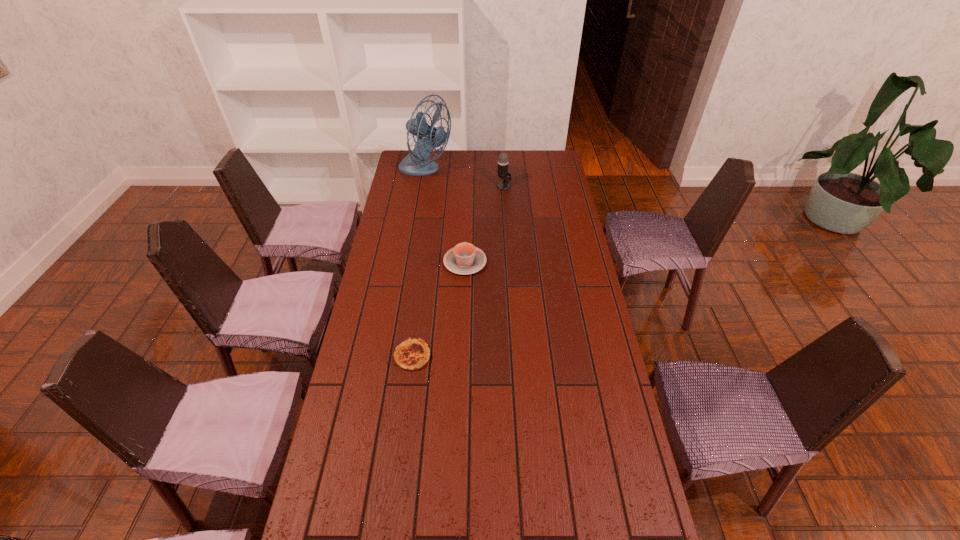
Find the location of a particular element. The height and width of the screenshot is (540, 960). vacant space located on the handle side of the third farthest object is located at coordinates (467, 205).

Where is `blank space located 0.180m on the handle side of the third farthest object`? blank space located 0.180m on the handle side of the third farthest object is located at coordinates (467, 221).

Image resolution: width=960 pixels, height=540 pixels. In order to click on blank area located on the front of the shortest object in this screenshot , I will do `click(405, 409)`.

Identify the location of object that is at the far edge. (429, 137).

Locate an element on the screen. fan that is at the left edge is located at coordinates (429, 137).

Image resolution: width=960 pixels, height=540 pixels. I want to click on quiche present at the left edge, so click(x=411, y=355).

The width and height of the screenshot is (960, 540). Identify the location of object that is positioned at the far left corner. (429, 137).

Image resolution: width=960 pixels, height=540 pixels. In the image, there is a desktop. Identify the location of free space at the far edge. (477, 164).

Locate an element on the screen. The height and width of the screenshot is (540, 960). vacant space at the left edge of the desktop is located at coordinates (415, 226).

Where is `free space at the right edge of the desktop`? Image resolution: width=960 pixels, height=540 pixels. free space at the right edge of the desktop is located at coordinates (561, 192).